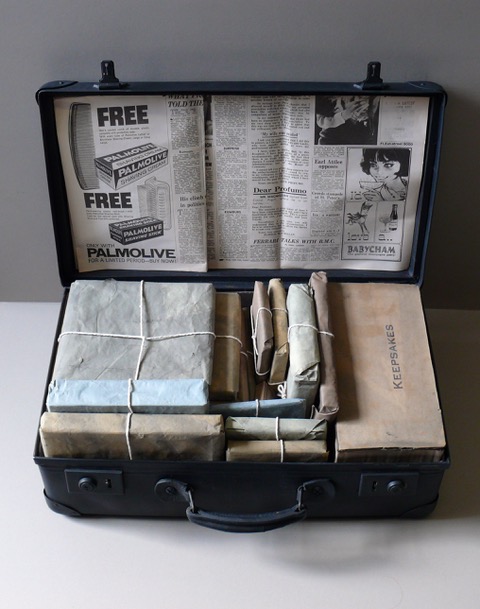
The image size is (480, 609). Identify the location of handle. (239, 523).